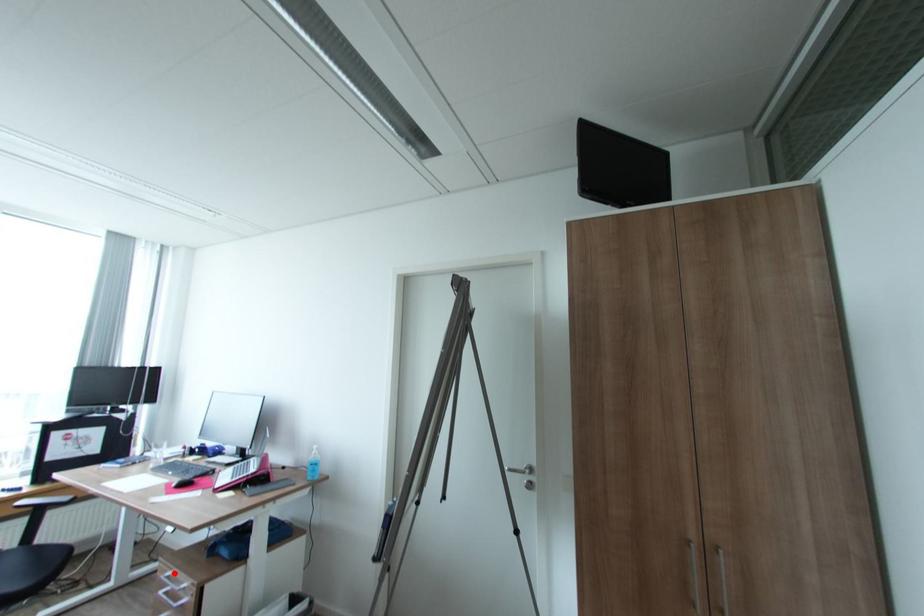
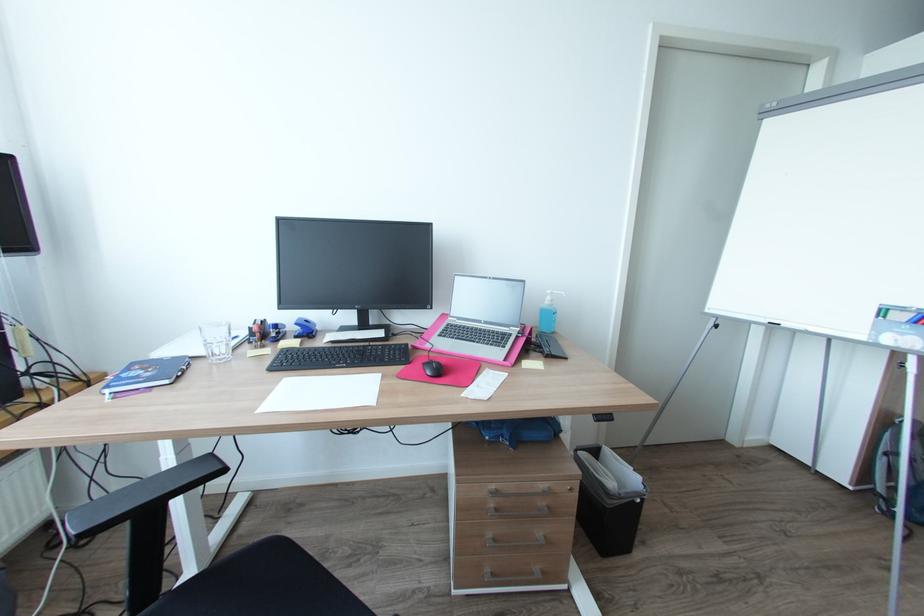
Question: I am providing you with two images of the same scene from different viewpoints. Given a red point in image1, look at the same physical point in image2. Is it:

Choices:
 (A) Closer to the viewpoint
 (B) Farther from the viewpoint

Answer: (B)